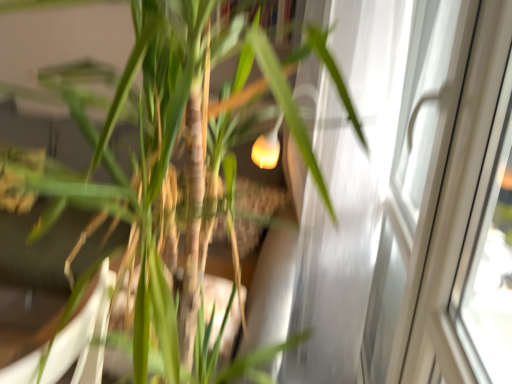
Measure the distance between green matte bamboo at center and camera.

They are 22.04 inches apart.

You are a GUI agent. You are given a task and a screenshot of the screen. Output one action in this format:
    pyautogui.click(x=<x>, y=<y>)
    Task: Click on the green matte bamboo at center
    The height and width of the screenshot is (384, 512).
    Given the screenshot: What is the action you would take?
    pyautogui.click(x=145, y=153)

This screenshot has height=384, width=512. What do you see at coordinates (145, 153) in the screenshot?
I see `green matte bamboo at center` at bounding box center [145, 153].

The image size is (512, 384). Describe the element at coordinates (377, 186) in the screenshot. I see `white glossy screen door at right` at that location.

Identify the location of white glossy screen door at right. The image size is (512, 384). (377, 186).

Where is `green matte bamboo at center`? The width and height of the screenshot is (512, 384). green matte bamboo at center is located at coordinates (145, 153).

Is white glossy screen door at right to the right of green matte bamboo at center from the viewer's perspective?

Yes, white glossy screen door at right is to the right of green matte bamboo at center.

Is the position of white glossy screen door at right less distant than that of green matte bamboo at center?

No, white glossy screen door at right is behind green matte bamboo at center.

Between point (459, 36) and point (173, 126), which one is positioned in front?

Point (173, 126)

From the image's perspective, would you say white glossy screen door at right is shown under green matte bamboo at center?

Incorrect, from the image's perspective, white glossy screen door at right is higher than green matte bamboo at center.

From a real-world perspective, which object stands above the other?

From a 3D spatial view, green matte bamboo at center is above.

Does white glossy screen door at right have a greater width compared to green matte bamboo at center?

No.

From the picture: Is white glossy screen door at right taller than green matte bamboo at center?

Correct, white glossy screen door at right is much taller as green matte bamboo at center.

Who is bigger, white glossy screen door at right or green matte bamboo at center?

With larger size is green matte bamboo at center.

Would you say white glossy screen door at right is inside or outside green matte bamboo at center?

white glossy screen door at right is not enclosed by green matte bamboo at center.

Is the surface of white glossy screen door at right in direct contact with green matte bamboo at center?

white glossy screen door at right and green matte bamboo at center are not in contact.

Is white glossy screen door at right turned away from green matte bamboo at center?

No, green matte bamboo at center is not at the back of white glossy screen door at right.

Based on the photo, how different are the orientations of white glossy screen door at right and green matte bamboo at center in degrees?

The facing directions of white glossy screen door at right and green matte bamboo at center are 0.426 degrees apart.

Measure the distance from white glossy screen door at right to green matte bamboo at center.

white glossy screen door at right is 43.99 centimeters from green matte bamboo at center.

This screenshot has height=384, width=512. I want to click on screen door directly beneath the green matte bamboo at center (from a real-world perspective), so click(377, 186).

Is green matte bamboo at center to the left or to the right of white glossy screen door at right in the image?

From the image, it's evident that green matte bamboo at center is to the left of white glossy screen door at right.

Is the position of green matte bamboo at center more distant than that of white glossy screen door at right?

No, green matte bamboo at center is closer to the viewer.

Is point (289, 112) closer or farther from the camera than point (407, 46)?

Point (289, 112).

From the image's perspective, is green matte bamboo at center beneath white glossy screen door at right?

Yes.

From a real-world perspective, between green matte bamboo at center and white glossy screen door at right, who is vertically lower?

white glossy screen door at right, from a real-world perspective.

Considering the sizes of objects green matte bamboo at center and white glossy screen door at right in the image provided, who is thinner, green matte bamboo at center or white glossy screen door at right?

white glossy screen door at right.

Can you confirm if green matte bamboo at center is shorter than white glossy screen door at right?

Yes.

Considering the relative sizes of green matte bamboo at center and white glossy screen door at right in the image provided, is green matte bamboo at center bigger than white glossy screen door at right?

Yes, green matte bamboo at center is bigger than white glossy screen door at right.

Consider the image. Is green matte bamboo at center surrounding white glossy screen door at right?

No, green matte bamboo at center does not contain white glossy screen door at right.

Are green matte bamboo at center and white glossy screen door at right located far from each other?

No, there isn't a large distance between green matte bamboo at center and white glossy screen door at right.

From the picture: Is green matte bamboo at center looking in the opposite direction of white glossy screen door at right?

No, white glossy screen door at right is not at the back of green matte bamboo at center.

The image size is (512, 384). In order to click on houseplant in front of the white glossy screen door at right in this screenshot , I will do `click(145, 153)`.

At what (x,y) coordinates should I click in order to perform the action: click on houseplant that appears below the white glossy screen door at right (from the image's perspective). Please return your answer as a coordinate pair (x, y). This screenshot has width=512, height=384. Looking at the image, I should click on (145, 153).

At what (x,y) coordinates should I click in order to perform the action: click on screen door below the green matte bamboo at center (from a real-world perspective). Please return your answer as a coordinate pair (x, y). Image resolution: width=512 pixels, height=384 pixels. Looking at the image, I should click on (377, 186).